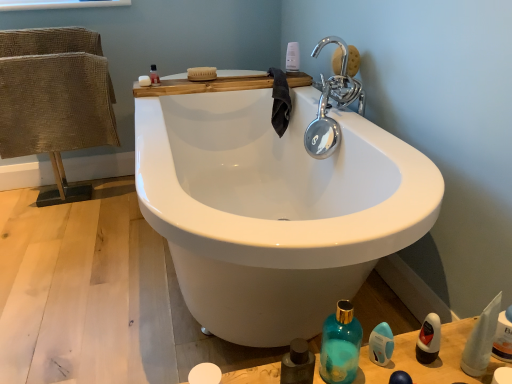
Question: In terms of height, does white matte soap at upper center look taller or shorter compared to white plastic bottle at upper center, the second toiletry in the right-to-left sequence?

Choices:
 (A) tall
 (B) short

Answer: (B)

Question: Is white matte soap at upper center bigger or smaller than white plastic bottle at upper center, the second toiletry in the right-to-left sequence?

Choices:
 (A) big
 (B) small

Answer: (B)

Question: Which is nearer to the white fabric towel at lower right, the 2th toiletry viewed from the front?

Choices:
 (A) white matte soap at upper center
 (B) teal glass bottle at lower right
 (C) translucent glass bottles at lower right
 (D) translucent plastic mouthwash at upper left, which is the 3th mouthwash in front-to-back order
 (E) blue glossy mouthwash at lower right, which is the 1th mouthwash in bottom-to-top order

Answer: (C)

Question: Which object is the closest to the blue glossy mouthwash at lower right, which is the 1th mouthwash in bottom-to-top order?

Choices:
 (A) translucent plastic mouthwash at upper left, acting as the 3th mouthwash starting from the bottom
 (B) white plastic bottle at upper center, placed as the 3th toiletry when sorted from bottom to top
 (C) white fabric towel at lower right, arranged as the 1th toiletry when viewed from the right
 (D) burlap fabric chair at left
 (E) white matte soap at upper center

Answer: (C)